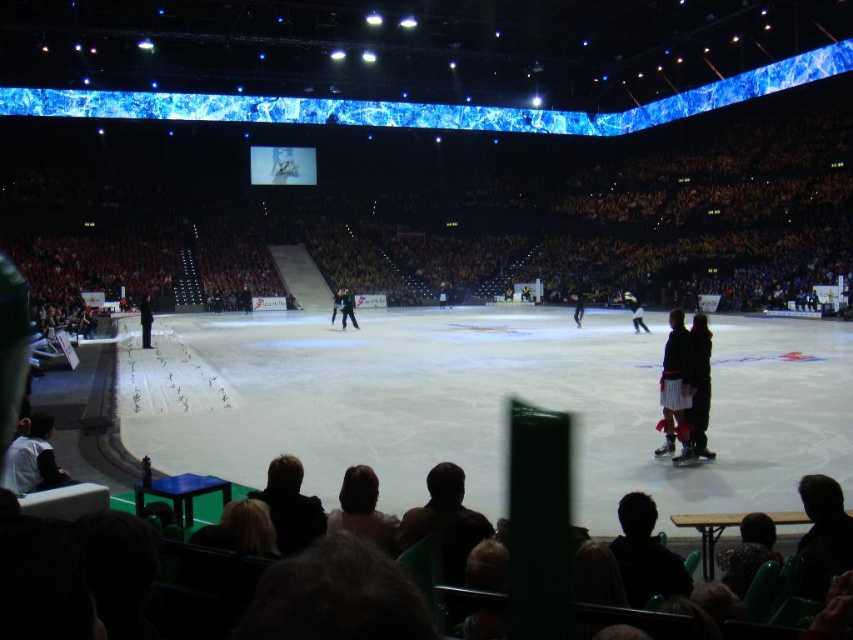
Question: Among these objects, which one is farthest from the camera?

Choices:
 (A) white ice rink at center
 (B) light blue fabric figure skater at center
 (C) dark brown leather seats at lower center

Answer: (C)

Question: Among these points, which one is nearest to the camera?

Choices:
 (A) (679, 342)
 (B) (704, 360)
 (C) (85, 252)
 (D) (196, 396)

Answer: (A)

Question: Can you confirm if dark brown fur coat at center is positioned above black fabric figure at center?

Choices:
 (A) no
 (B) yes

Answer: (A)

Question: Which of the following is the closest to the observer?

Choices:
 (A) (265, 474)
 (B) (345, 300)
 (C) (660, 412)

Answer: (A)

Question: Is dark brown leather seats at lower center below dark brown fur coat at center?

Choices:
 (A) no
 (B) yes

Answer: (A)

Question: Is white ice rink at center below dark brown fur coat at center?

Choices:
 (A) no
 (B) yes

Answer: (A)